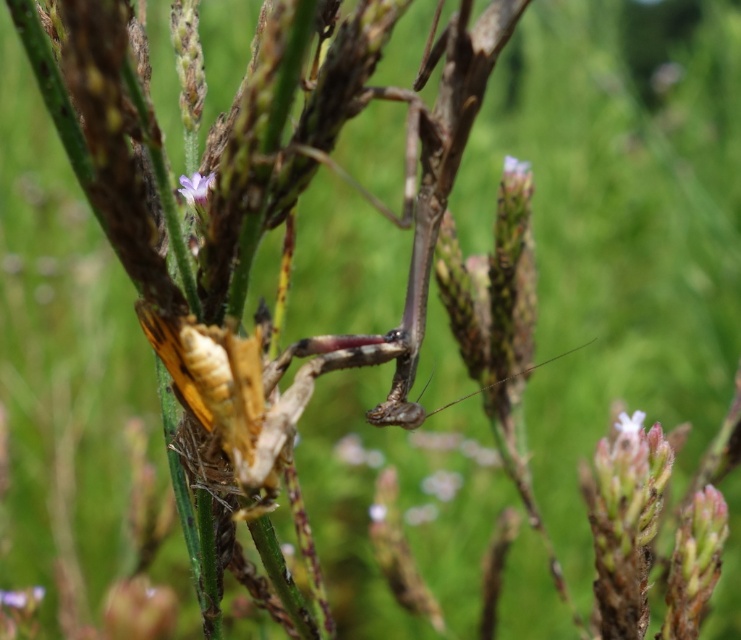
Question: Estimate the real-world distances between objects in this image. Which object is closer to the smooth white flower at upper center?

Choices:
 (A) purple matte flower at upper center
 (B) purple matte flower at center

Answer: (B)

Question: From the image, what is the correct spatial relationship of purple matte flower at upper center in relation to purple matte flower at center?

Choices:
 (A) above
 (B) below

Answer: (A)

Question: Can you confirm if purple matte flower at upper center is positioned above purple matte flower at center?

Choices:
 (A) no
 (B) yes

Answer: (B)

Question: Considering the real-world distances, which object is closest to the purple matte flower at upper center?

Choices:
 (A) purple matte flower at center
 (B) smooth white flower at upper center

Answer: (A)

Question: Can you confirm if purple matte flower at upper center is bigger than purple matte flower at center?

Choices:
 (A) yes
 (B) no

Answer: (B)

Question: Which object appears farthest from the camera in this image?

Choices:
 (A) smooth white flower at upper center
 (B) purple matte flower at upper center
 (C) purple matte flower at center

Answer: (A)